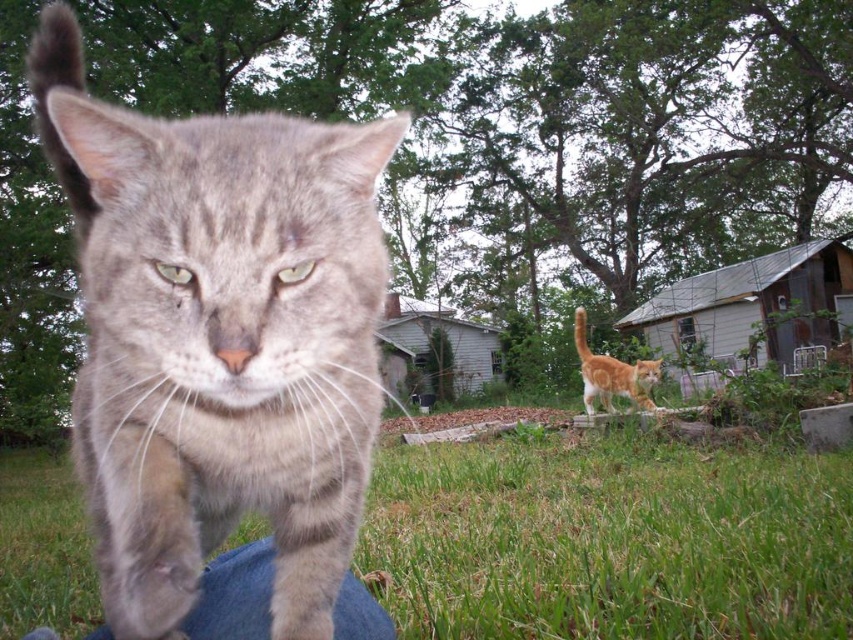
You are trying to determine if the orange tabby cat at center can hear a sound coming from the green grass at lower center. Assuming sound travels at 343 meters per second, how many seconds would it take for the sound to reach the cat?

The distance between the green grass at lower center and the orange tabby cat at center is 3.56 meters. Since sound travels at 343 meters per second, it would take approximately 0.01 seconds for the sound to reach the cat.

You are sitting on a bench in the park and see the gray striped cat at center and the green grass at lower center. Which one is closer to you?

The gray striped cat at center is closer to you because it is in front of the green grass at lower center.